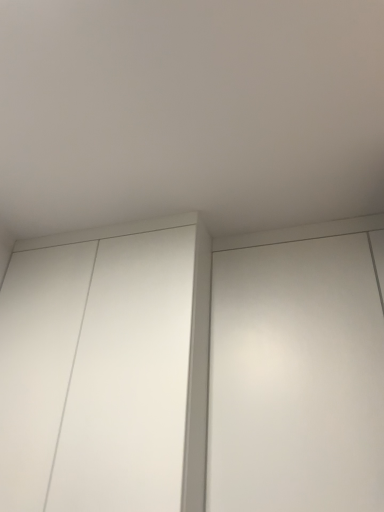
In order to click on white matte cupboard at center in this screenshot , I will do `click(82, 359)`.

This screenshot has height=512, width=384. Describe the element at coordinates (82, 359) in the screenshot. I see `white matte cupboard at center` at that location.

In order to face white matte cupboard at center, should I rotate leftwards or rightwards?

It's best to rotate left around 11.477 degrees.

The image size is (384, 512). Identify the location of white matte elevator at right. (296, 378).

What do you see at coordinates (296, 378) in the screenshot? Image resolution: width=384 pixels, height=512 pixels. I see `white matte elevator at right` at bounding box center [296, 378].

I want to click on white matte cupboard at center, so click(x=82, y=359).

Does white matte cupboard at center appear on the left side of white matte elevator at right?

Indeed, white matte cupboard at center is positioned on the left side of white matte elevator at right.

Considering their positions, is white matte cupboard at center located in front of or behind white matte elevator at right?

In the image, white matte cupboard at center appears behind white matte elevator at right.

Which is closer to the camera, [64,351] or [272,373]?

Point [64,351] appears to be farther away from the viewer than point [272,373].

Consider the image. From the image's perspective, between white matte cupboard at center and white matte elevator at right, which one is located above?

white matte elevator at right is shown above in the image.

Based on the photo, from a real-world perspective, who is located lower, white matte cupboard at center or white matte elevator at right?

From a 3D spatial view, white matte cupboard at center is below.

In the scene shown: Which object is wider, white matte cupboard at center or white matte elevator at right?

Wider between the two is white matte cupboard at center.

Who is shorter, white matte cupboard at center or white matte elevator at right?

white matte elevator at right.

Who is smaller, white matte cupboard at center or white matte elevator at right?

white matte elevator at right.

Is white matte cupboard at center inside or outside of white matte elevator at right?

white matte cupboard at center is located beyond the bounds of white matte elevator at right.

Is white matte cupboard at center positioned far away from white matte elevator at right?

No, white matte cupboard at center is in close proximity to white matte elevator at right.

Is white matte cupboard at center positioned with its back to white matte elevator at right?

white matte cupboard at center is not turned away from white matte elevator at right.

How different are the orientations of white matte cupboard at center and white matte elevator at right in degrees?

The angular difference between white matte cupboard at center and white matte elevator at right is 9.47e-06 degrees.

At what (x,y) coordinates should I click in order to perform the action: click on cupboard that is on the left side of white matte elevator at right. Please return your answer as a coordinate pair (x, y). This screenshot has width=384, height=512. Looking at the image, I should click on (82, 359).

Considering the relative positions of white matte elevator at right and white matte cupboard at center in the image provided, is white matte elevator at right to the right of white matte cupboard at center from the viewer's perspective?

Yes, white matte elevator at right is to the right of white matte cupboard at center.

In the scene shown: Which is behind, white matte elevator at right or white matte cupboard at center?

Positioned behind is white matte cupboard at center.

Which is nearer, (x=348, y=424) or (x=49, y=418)?

The point (x=348, y=424) is more forward.

From the image's perspective, which is above, white matte elevator at right or white matte cupboard at center?

white matte elevator at right.

From a real-world perspective, which is physically below, white matte elevator at right or white matte cupboard at center?

white matte cupboard at center, from a real-world perspective.

Considering the sizes of white matte elevator at right and white matte cupboard at center in the image, is white matte elevator at right wider or thinner than white matte cupboard at center?

white matte elevator at right is thinner than white matte cupboard at center.

Considering the sizes of white matte elevator at right and white matte cupboard at center in the image, is white matte elevator at right taller or shorter than white matte cupboard at center?

Clearly, white matte elevator at right is shorter compared to white matte cupboard at center.

Looking at the image, does white matte elevator at right seem bigger or smaller compared to white matte cupboard at center?

In the image, white matte elevator at right appears to be smaller than white matte cupboard at center.

Can we say white matte elevator at right lies outside white matte cupboard at center?

Absolutely, white matte elevator at right is external to white matte cupboard at center.

Is white matte elevator at right positioned far away from white matte cupboard at center?

No, white matte elevator at right is in close proximity to white matte cupboard at center.

Is white matte elevator at right facing towards white matte cupboard at center?

No, white matte elevator at right does not turn towards white matte cupboard at center.

What's the angular difference between white matte elevator at right and white matte cupboard at center's facing directions?

The facing directions of white matte elevator at right and white matte cupboard at center are 9.47e-06 degrees apart.

This screenshot has height=512, width=384. Find the location of `elevator above the white matte cupboard at center (from a real-world perspective)`. elevator above the white matte cupboard at center (from a real-world perspective) is located at coordinates (296, 378).

Identify the location of cupboard below the white matte elevator at right (from the image's perspective). pos(82,359).

Where is `elevator that appears in front of the white matte cupboard at center`? elevator that appears in front of the white matte cupboard at center is located at coordinates (296, 378).